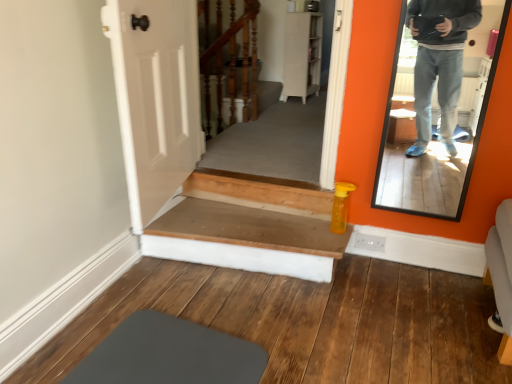
Question: Is wooden stairwell at center turned away from wooden stairs at center?

Choices:
 (A) no
 (B) yes

Answer: (A)

Question: Is wooden stairwell at center next to wooden stairs at center and touching it?

Choices:
 (A) yes
 (B) no

Answer: (B)

Question: Does wooden stairwell at center have a larger size compared to wooden stairs at center?

Choices:
 (A) yes
 (B) no

Answer: (A)

Question: Is wooden stairwell at center shorter than wooden stairs at center?

Choices:
 (A) no
 (B) yes

Answer: (A)

Question: Is wooden stairwell at center closer to camera compared to wooden stairs at center?

Choices:
 (A) no
 (B) yes

Answer: (A)

Question: Is wooden stairwell at center thinner than wooden stairs at center?

Choices:
 (A) yes
 (B) no

Answer: (A)

Question: Is wooden stairwell at center completely or partially inside wooden stairs at center?

Choices:
 (A) no
 (B) yes

Answer: (A)

Question: Is the position of wooden stairs at center more distant than that of wooden stairwell at center?

Choices:
 (A) yes
 (B) no

Answer: (B)

Question: Is wooden stairs at center shorter than wooden stairwell at center?

Choices:
 (A) no
 (B) yes

Answer: (B)

Question: From a real-world perspective, is wooden stairs at center positioned over wooden stairwell at center based on gravity?

Choices:
 (A) no
 (B) yes

Answer: (A)

Question: Does wooden stairs at center have a larger size compared to wooden stairwell at center?

Choices:
 (A) no
 (B) yes

Answer: (A)

Question: Is wooden stairs at center thinner than wooden stairwell at center?

Choices:
 (A) no
 (B) yes

Answer: (A)

Question: Is wooden stairs at center located within matte black mirror at right?

Choices:
 (A) no
 (B) yes

Answer: (A)